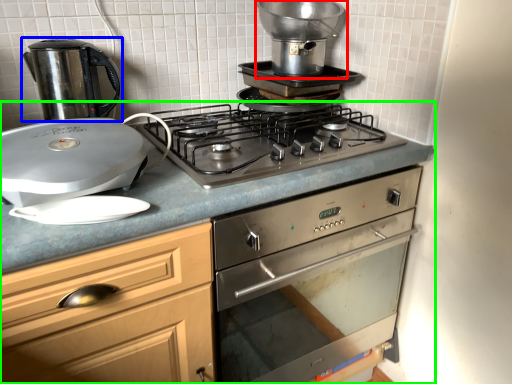
Question: Estimate the real-world distances between objects in this image. Which object is farther from kitchen appliance (highlighted by a red box), kitchen appliance (highlighted by a blue box) or countertop (highlighted by a green box)?

Choices:
 (A) kitchen appliance
 (B) countertop

Answer: (A)